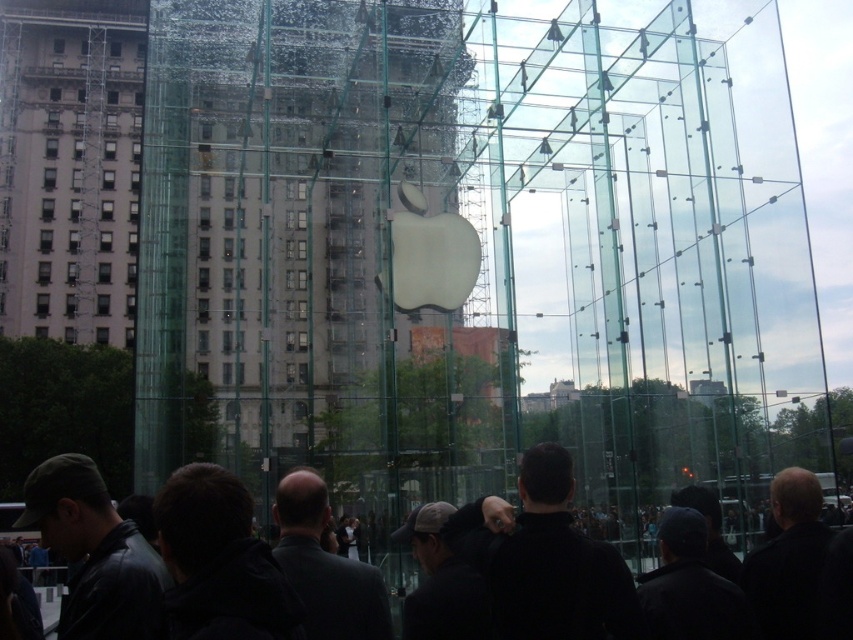
You are standing in front of the glass structure and notice the transparent glass cube at center and the dark gray jacket at center. Which object is wider?

The transparent glass cube at center is wider than the dark gray jacket at center.